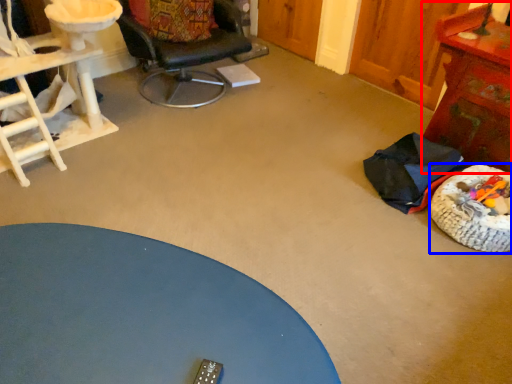
Question: Which object is closer to the camera taking this photo, table (highlighted by a red box) or dog bed (highlighted by a blue box)?

Choices:
 (A) table
 (B) dog bed

Answer: (B)